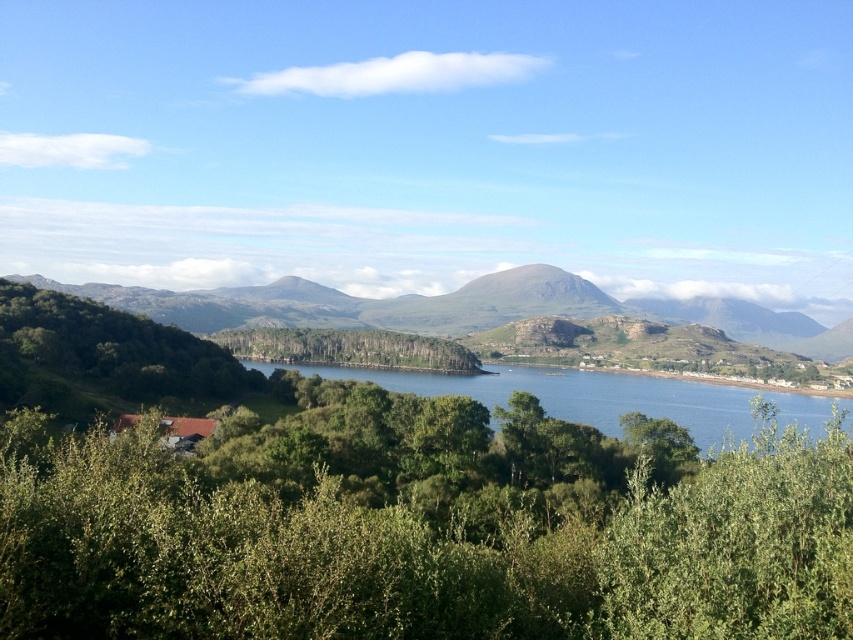
Question: Which object appears closest to the camera in this image?

Choices:
 (A) green leafy tree at center
 (B) green textured hillside at center
 (C) blue water at center
 (D) green leafy tree at lower left

Answer: (D)

Question: Which object is the farthest from the green leafy tree at center?

Choices:
 (A) green textured hillside at center
 (B) green leafy tree at lower left
 (C) green leafy tree at left
 (D) blue water at center

Answer: (B)

Question: Considering the relative positions of green leafy tree at left and green leafy tree at center in the image provided, where is green leafy tree at left located with respect to green leafy tree at center?

Choices:
 (A) left
 (B) right

Answer: (A)

Question: Is green textured hillside at center to the left of blue water at center from the viewer's perspective?

Choices:
 (A) no
 (B) yes

Answer: (B)

Question: Which object is closer to the camera taking this photo?

Choices:
 (A) green leafy tree at left
 (B) green leafy tree at center

Answer: (A)

Question: Does green textured hillside at center appear over green leafy tree at center?

Choices:
 (A) yes
 (B) no

Answer: (A)